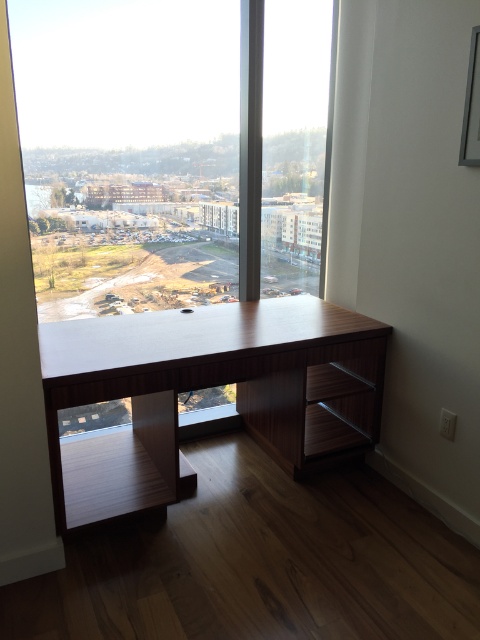
Can you confirm if transparent glass window at center is positioned below wooden desk at center?

Incorrect, transparent glass window at center is not positioned below wooden desk at center.

Does transparent glass window at center have a larger size compared to wooden desk at center?

Correct, transparent glass window at center is larger in size than wooden desk at center.

Which is in front, point (162, 4) or point (311, 400)?

Point (162, 4)

Where is `transparent glass window at center`? transparent glass window at center is located at coordinates (129, 148).